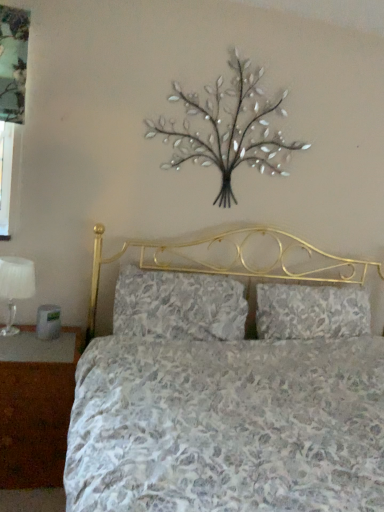
Where is `free spot above metallic silver tree at upper center (from a real-world perspective)`? The height and width of the screenshot is (512, 384). free spot above metallic silver tree at upper center (from a real-world perspective) is located at coordinates (231, 40).